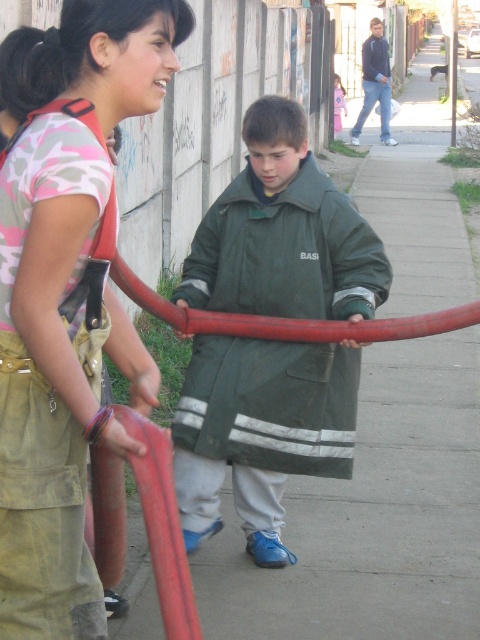
The height and width of the screenshot is (640, 480). What do you see at coordinates (67, 292) in the screenshot?
I see `camouflage fabric shirt at center` at bounding box center [67, 292].

The height and width of the screenshot is (640, 480). Find the location of `camouflage fabric shirt at center`. camouflage fabric shirt at center is located at coordinates click(x=67, y=292).